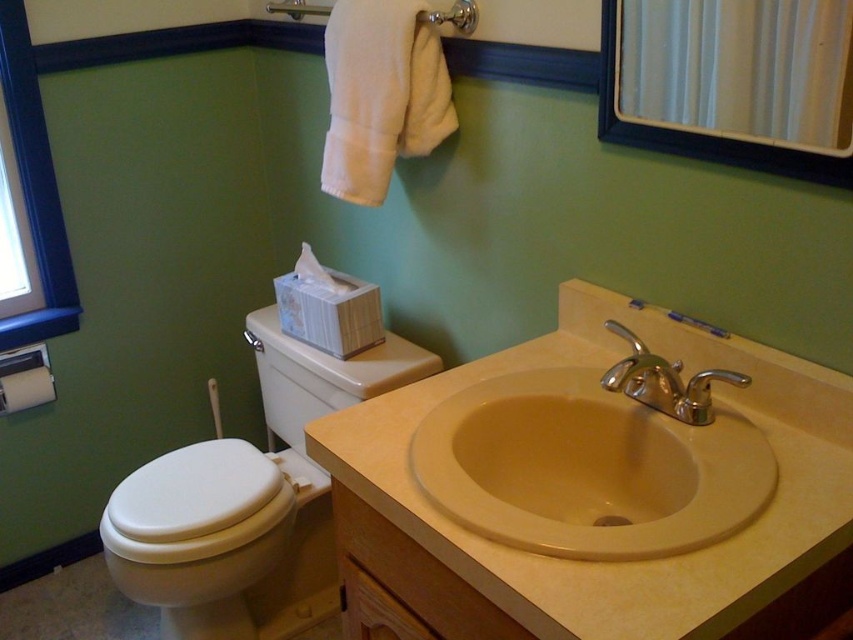
Which of these two, white glossy toilet bowl at left or matte white towel bar at left, stands shorter?

Standing shorter between the two is matte white towel bar at left.

Locate an element on the screen. Image resolution: width=853 pixels, height=640 pixels. white glossy toilet bowl at left is located at coordinates (248, 500).

Find the location of a particular element. The width and height of the screenshot is (853, 640). white glossy toilet bowl at left is located at coordinates (248, 500).

Measure the distance between point (x=223, y=630) and camera.

Point (x=223, y=630) and camera are 5.84 feet apart.

Between point (229, 502) and point (619, 372), which one is positioned in front?

Point (619, 372)

The image size is (853, 640). I want to click on white glossy toilet bowl at left, so click(248, 500).

Can you confirm if beige laminate sink at center is wider than beige ceramic sink at center?

Yes, beige laminate sink at center is wider than beige ceramic sink at center.

Does beige laminate sink at center have a greater height compared to beige ceramic sink at center?

Correct, beige laminate sink at center is much taller as beige ceramic sink at center.

Identify the location of beige laminate sink at center. This screenshot has height=640, width=853. (596, 492).